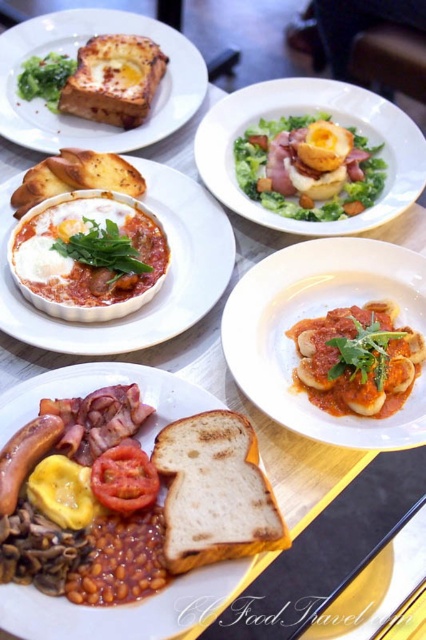
Is point (19, 634) closer to camera compared to point (288, 195)?

Yes, it is.

Who is taller, white bread at center or matte yellow egg at center?

matte yellow egg at center

Identify the location of white bread at center. (123, 609).

Who is positioned more to the right, white bread at center or golden brown toasted bread at upper left?

white bread at center

I want to click on white bread at center, so coord(123,609).

Is white creamy sauce at center below red matte tomato at center?

Actually, white creamy sauce at center is above red matte tomato at center.

Does white creamy sauce at center have a greater height compared to red matte tomato at center?

Correct, white creamy sauce at center is much taller as red matte tomato at center.

Is point (100, 292) farther from viewer compared to point (135, 497)?

That is True.

This screenshot has height=640, width=426. I want to click on white creamy sauce at center, so click(x=83, y=257).